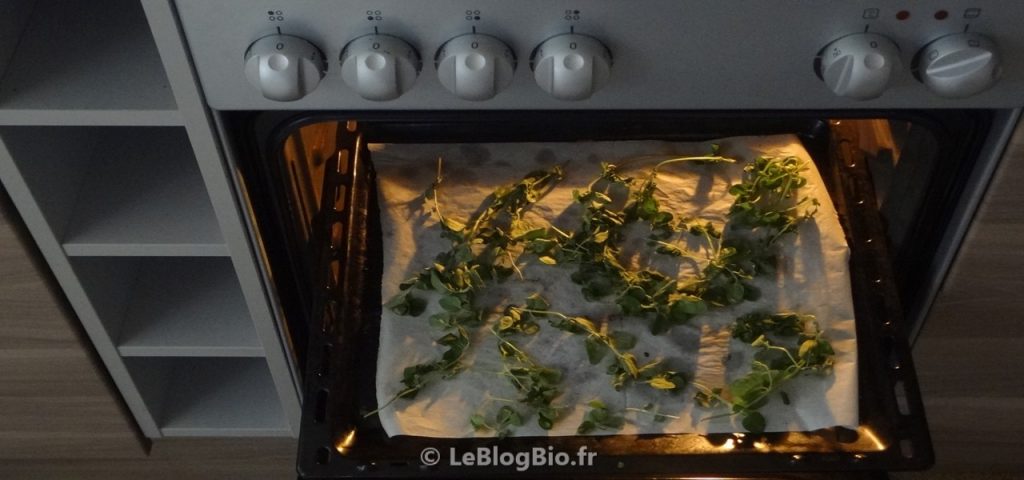
Where is `top shelf`? This screenshot has height=480, width=1024. top shelf is located at coordinates (104, 62).